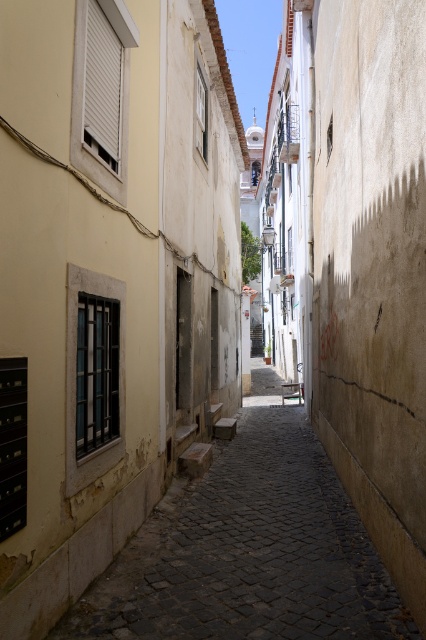
You are standing in the alley and want to walk from point (363, 280) to point (351, 576). Which direction should you turn to reach the second point?

You should turn towards the direction away from the camera because point (351, 576) is closer to the camera than point (363, 280).

You are a delivery person holding a package that requires a 4 meter minimum distance to safely throw it into the mail slot below the window with black metal bars on the left. Can you determine if the smooth beige wall at right is within the required distance?

The smooth beige wall at right is 4.16 meters from camera, so it is just beyond the 4 meter minimum distance. However, this distance refers to the wall itself, not the mail slot. Since the mail slot is on the left side of the alley, the distance to it may differ and needs to be checked separately.